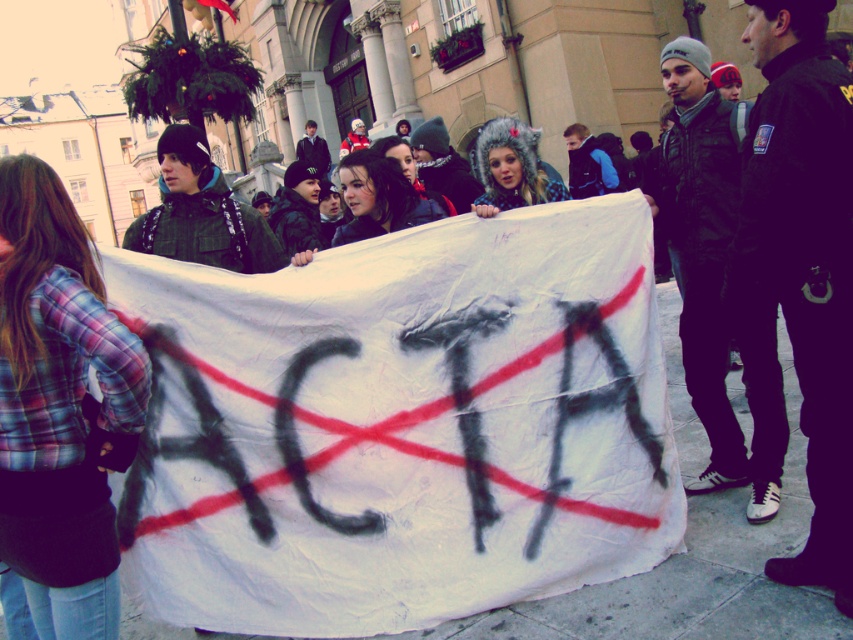
You are a photographer standing at the edge of the protest. You need to capture a photo of both the plaid fabric shirt at center and the fuzzy fur hat at center in the same frame. Given that your camera has a maximum focus range of 3 meters, will you be able to capture both subjects clearly in one shot?

The distance between the plaid fabric shirt at center and the fuzzy fur hat at center is 3.25 meters. Since your camera can only focus up to 3 meters, the subjects are slightly out of the focus range. You might need to adjust your position or use a different lens to ensure both are in focus.

Consider the image. You are a photographer trying to capture a clear shot of the protest banner. You notice the plaid fabric shirt at center and the dark brown hair at center are blocking your view. Which object should you move to the side to get a better angle?

You should ask the person wearing the plaid fabric shirt at center to move since it is wider than the dark brown hair at center and is blocking more of the view.